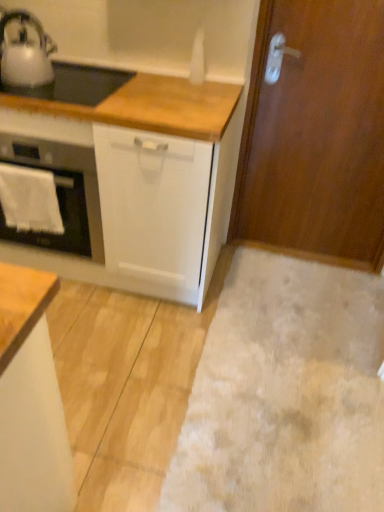
Question: Is beige carpet at lower right turned away from white matte cabinet at lower left?

Choices:
 (A) yes
 (B) no

Answer: (B)

Question: Considering the relative sizes of beige carpet at lower right and white matte cabinet at lower left in the image provided, is beige carpet at lower right shorter than white matte cabinet at lower left?

Choices:
 (A) no
 (B) yes

Answer: (B)

Question: From a real-world perspective, is beige carpet at lower right under white matte cabinet at lower left?

Choices:
 (A) yes
 (B) no

Answer: (A)

Question: Is white matte cabinet at lower left inside beige carpet at lower right?

Choices:
 (A) yes
 (B) no

Answer: (B)

Question: Is beige carpet at lower right taller than white matte cabinet at lower left?

Choices:
 (A) yes
 (B) no

Answer: (B)

Question: In the image, is wooden door at right on the left side or the right side of white matte cabinet at lower left?

Choices:
 (A) right
 (B) left

Answer: (A)

Question: Considering their positions, is wooden door at right located in front of or behind white matte cabinet at lower left?

Choices:
 (A) front
 (B) behind

Answer: (B)

Question: From their relative heights in the image, would you say wooden door at right is taller or shorter than white matte cabinet at lower left?

Choices:
 (A) short
 (B) tall

Answer: (B)

Question: Considering the positions of wooden door at right and white matte cabinet at lower left in the image, is wooden door at right bigger or smaller than white matte cabinet at lower left?

Choices:
 (A) big
 (B) small

Answer: (B)

Question: From the image's perspective, relative to metallic silver kettle at upper left, is white towel at left above or below?

Choices:
 (A) above
 (B) below

Answer: (B)

Question: Does point (52, 184) appear closer or farther from the camera than point (21, 77)?

Choices:
 (A) closer
 (B) farther

Answer: (B)

Question: Is white towel at left in front of or behind metallic silver kettle at upper left in the image?

Choices:
 (A) behind
 (B) front

Answer: (A)

Question: Is white towel at left inside the boundaries of metallic silver kettle at upper left, or outside?

Choices:
 (A) inside
 (B) outside

Answer: (B)

Question: From the image's perspective, relative to wooden door at right, is white matte cabinet at lower left above or below?

Choices:
 (A) below
 (B) above

Answer: (A)

Question: Considering the positions of white matte cabinet at lower left and wooden door at right in the image, is white matte cabinet at lower left taller or shorter than wooden door at right?

Choices:
 (A) tall
 (B) short

Answer: (B)